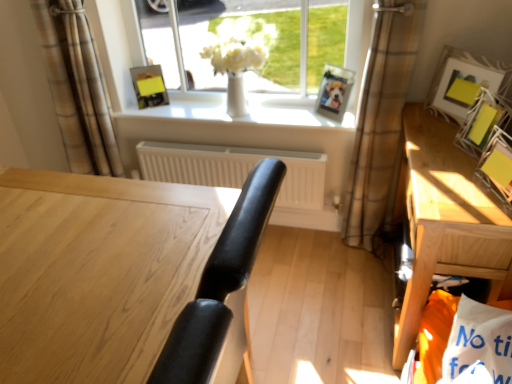
Question: Is brown plaid curtain at upper left, which is counted as the 2th curtain, starting from the right, to the left of matte white picture frame at upper right, the 3th picture frame when ordered from front to back, from the viewer's perspective?

Choices:
 (A) no
 (B) yes

Answer: (B)

Question: Is brown plaid curtain at upper left, marked as the first curtain in a left-to-right arrangement, to the right of matte white picture frame at upper right, the third picture frame from the right, from the viewer's perspective?

Choices:
 (A) no
 (B) yes

Answer: (A)

Question: Does brown plaid curtain at upper left, marked as the first curtain in a left-to-right arrangement, have a greater width compared to matte white picture frame at upper right, the 3th picture frame when ordered from front to back?

Choices:
 (A) yes
 (B) no

Answer: (A)

Question: Is brown plaid curtain at upper left, marked as the first curtain in a left-to-right arrangement, closer to the viewer compared to matte white picture frame at upper right, the 3th picture frame when ordered from front to back?

Choices:
 (A) yes
 (B) no

Answer: (B)

Question: Is brown plaid curtain at upper left, marked as the first curtain in a left-to-right arrangement, outside of matte white picture frame at upper right, the 3th picture frame when ordered from front to back?

Choices:
 (A) no
 (B) yes

Answer: (B)

Question: Does brown plaid curtain at upper left, which is counted as the 2th curtain, starting from the right, come behind matte white picture frame at upper right, which is the third picture frame in back-to-front order?

Choices:
 (A) yes
 (B) no

Answer: (A)

Question: Is white matte radiator at center at the back of white glossy vase at center?

Choices:
 (A) yes
 (B) no

Answer: (B)

Question: Considering the relative positions of white glossy vase at center and white matte radiator at center in the image provided, is white glossy vase at center to the right of white matte radiator at center from the viewer's perspective?

Choices:
 (A) yes
 (B) no

Answer: (A)

Question: Is white glossy vase at center not within white matte radiator at center?

Choices:
 (A) yes
 (B) no

Answer: (A)

Question: Is white glossy vase at center thinner than white matte radiator at center?

Choices:
 (A) no
 (B) yes

Answer: (B)

Question: Considering the relative sizes of white glossy vase at center and white matte radiator at center in the image provided, is white glossy vase at center wider than white matte radiator at center?

Choices:
 (A) yes
 (B) no

Answer: (B)

Question: Considering the relative sizes of white glossy vase at center and white matte radiator at center in the image provided, is white glossy vase at center bigger than white matte radiator at center?

Choices:
 (A) yes
 (B) no

Answer: (A)

Question: Is the depth of yellow paper at upper right, which is counted as the fifth picture frame, starting from the back, greater than that of wooden table at right?

Choices:
 (A) no
 (B) yes

Answer: (A)